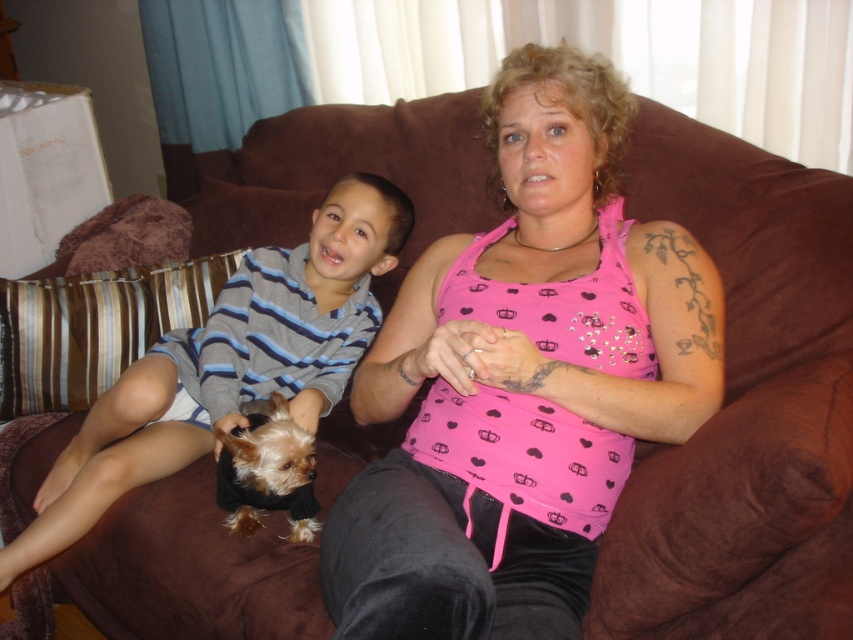
Question: Which point is farther to the camera?

Choices:
 (A) fuzzy black dog at center
 (B) black velvet pants at center
 (C) pink fabric tank top at center

Answer: (A)

Question: Considering the real-world distances, which object is closest to the black velvet pants at center?

Choices:
 (A) fuzzy black dog at center
 (B) striped knit sweater at left

Answer: (A)

Question: In this image, where is black velvet pants at center located relative to fuzzy black dog at center?

Choices:
 (A) below
 (B) above

Answer: (A)

Question: From the image, what is the correct spatial relationship of pink fabric tank top at center in relation to black velvet pants at center?

Choices:
 (A) above
 (B) below

Answer: (A)

Question: Can you confirm if striped knit sweater at left is positioned above black velvet pants at center?

Choices:
 (A) no
 (B) yes

Answer: (B)

Question: Among these objects, which one is farthest from the camera?

Choices:
 (A) fuzzy black dog at center
 (B) pink fabric tank top at center

Answer: (A)